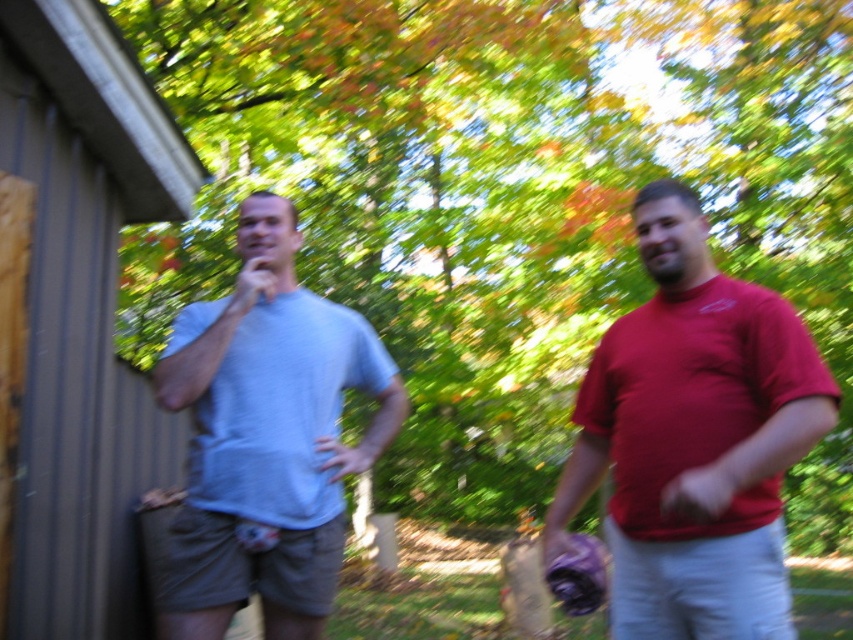
Does wooden plank at left have a greater width compared to purple fabric baseball glove at lower right?

Yes.

Who is more distant from viewer, (x=131, y=508) or (x=593, y=541)?

The point (x=131, y=508) is behind.

Where is `wooden plank at left`? The height and width of the screenshot is (640, 853). wooden plank at left is located at coordinates (79, 314).

Based on the photo, can you confirm if matte red t-shirt at right is wider than purple fabric baseball glove at lower right?

Yes.

What do you see at coordinates (694, 438) in the screenshot? I see `matte red t-shirt at right` at bounding box center [694, 438].

Identify the location of matte red t-shirt at right. (694, 438).

Is light blue cotton t-shirt at left wider than matte red t-shirt at right?

No, light blue cotton t-shirt at left is not wider than matte red t-shirt at right.

Between point (659, 412) and point (666, 403), which one is positioned in front?

Point (666, 403) is in front.

Is point (685, 481) more distant than point (767, 572)?

No, it is in front of (767, 572).

This screenshot has width=853, height=640. Identify the location of light blue cotton t-shirt at left. (694, 436).